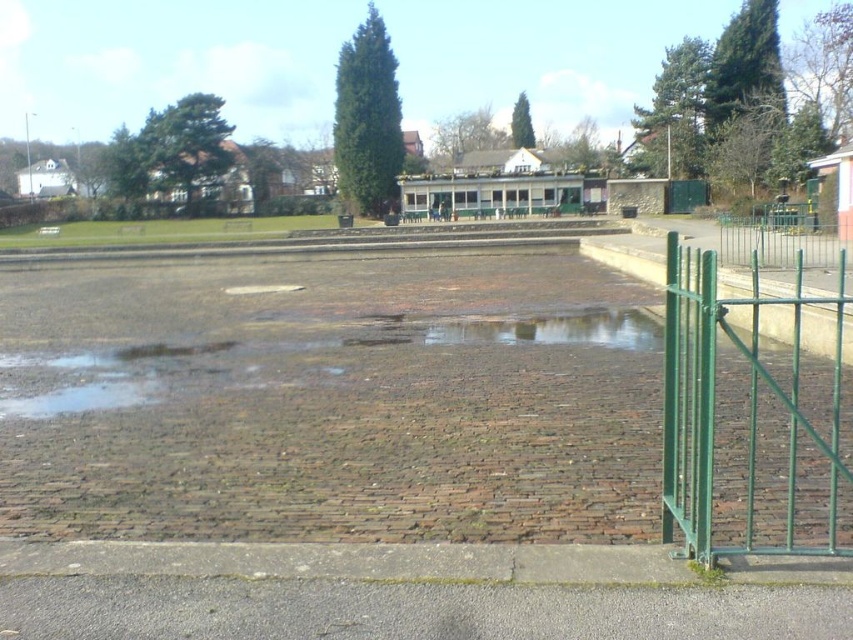
You are a delivery person trying to navigate through the paved area. You see the shiny brown puddle at center and the green metal fence at right. Which object is closer to the ground?

The shiny brown puddle at center is closer to the ground since it is located below the green metal fence at right.